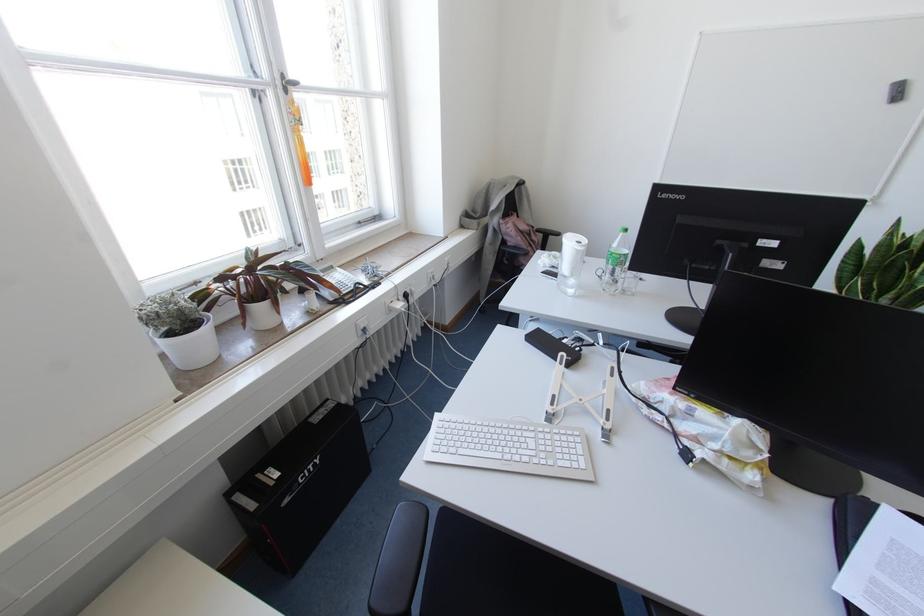
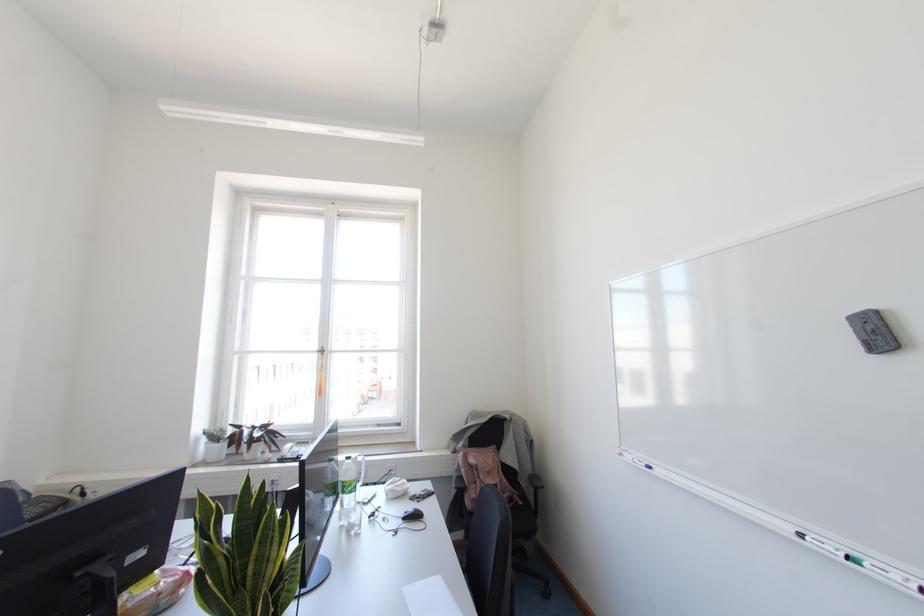
Locate, in the second image, the point that corresponds to point (285, 90) in the first image.

(322, 353)